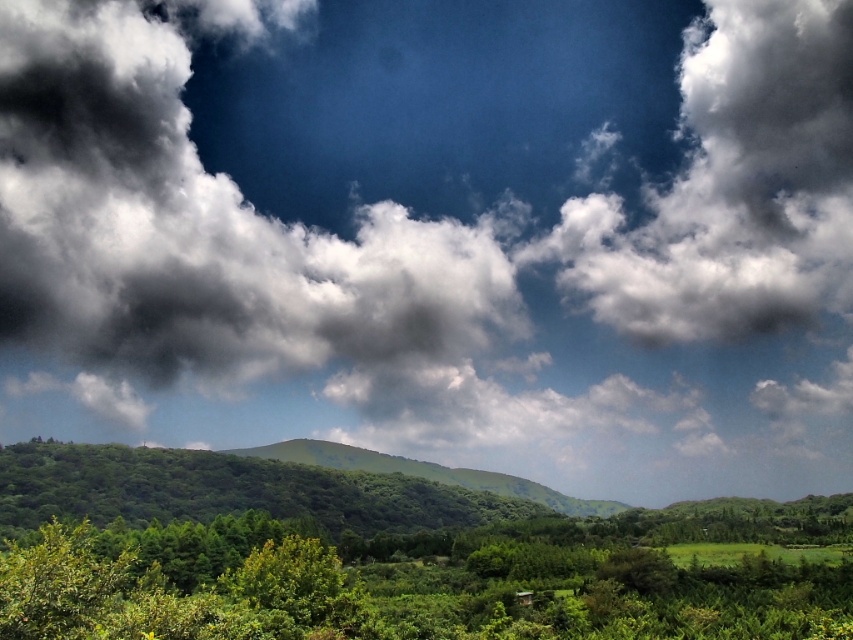
Which is above, white fluffy cloud at upper right or green leafy tree at lower center?

Positioned higher is white fluffy cloud at upper right.

Does point (756, 177) come in front of point (743, 572)?

No.

Is point (788, 228) behind point (640, 584)?

That is True.

Locate an element on the screen. Image resolution: width=853 pixels, height=640 pixels. white fluffy cloud at upper right is located at coordinates (734, 188).

Can you confirm if white fluffy cloud at upper right is positioned to the left of green leafy tree at center?

No, white fluffy cloud at upper right is not to the left of green leafy tree at center.

Based on the photo, can you confirm if white fluffy cloud at upper right is positioned to the right of green leafy tree at center?

Correct, you'll find white fluffy cloud at upper right to the right of green leafy tree at center.

Which is in front, point (767, 67) or point (294, 564)?

Point (294, 564) is more forward.

In order to click on white fluffy cloud at upper right in this screenshot , I will do `click(734, 188)`.

Is green leafy tree at lower center thinner than green leafy tree at center?

In fact, green leafy tree at lower center might be wider than green leafy tree at center.

Does green leafy tree at lower center appear on the left side of green leafy tree at center?

In fact, green leafy tree at lower center is to the right of green leafy tree at center.

Which is behind, point (741, 618) or point (317, 621)?

Positioned behind is point (741, 618).

This screenshot has width=853, height=640. I want to click on green leafy tree at lower center, so click(x=405, y=595).